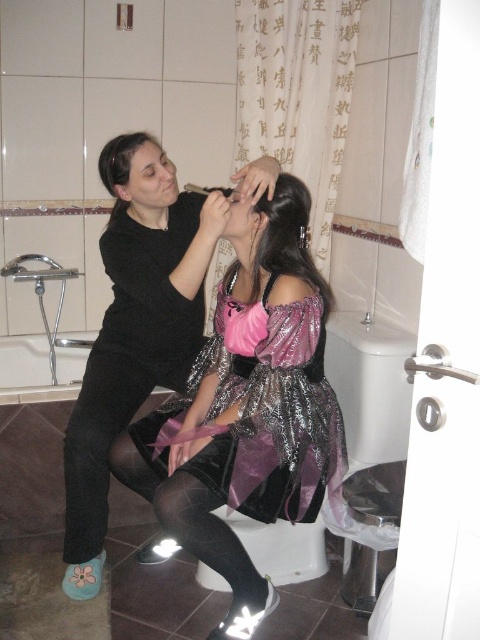
Between matte black dress at center and shiny purple dress at center, which one has less height?

shiny purple dress at center

Find the location of `matte black dress at center`. matte black dress at center is located at coordinates (134, 328).

Is point (368, 458) farther from viewer compared to point (90, 365)?

No, it is in front of (90, 365).

From the picture: Does white glossy toilet bowl at lower center lie behind black matte pants at lower left?

No.

Does point (256, 557) lie in front of point (110, 426)?

No.

The height and width of the screenshot is (640, 480). I want to click on white glossy toilet bowl at lower center, so click(x=370, y=387).

Who is lower down, black matte pants at lower left or shiny dark hair at center?

black matte pants at lower left

Who is shorter, black matte pants at lower left or shiny dark hair at center?

With less height is shiny dark hair at center.

This screenshot has width=480, height=640. I want to click on black matte pants at lower left, so click(x=99, y=442).

The height and width of the screenshot is (640, 480). In order to click on black matte pants at lower left in this screenshot , I will do `click(99, 442)`.